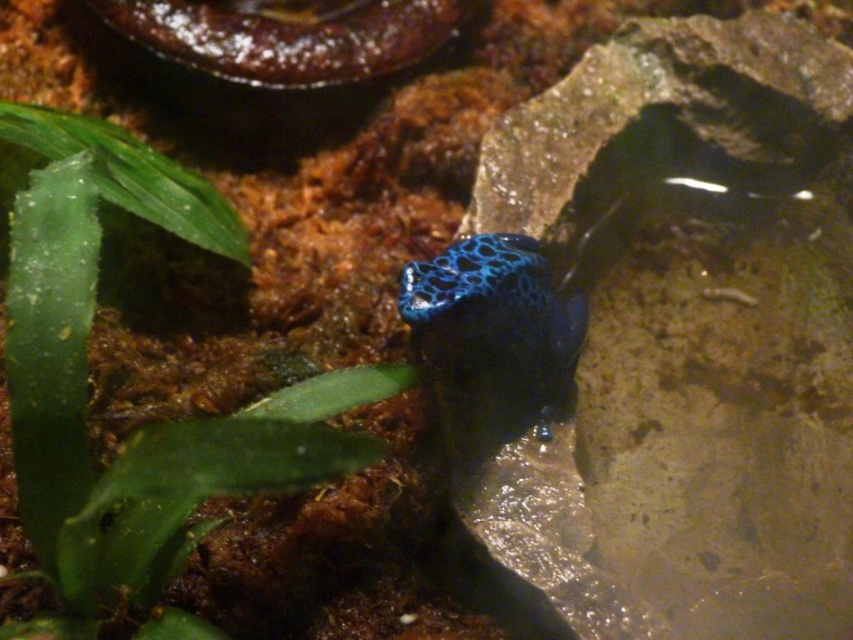
Question: Does green leafy plant at upper left appear over blue glossy frog at center?

Choices:
 (A) yes
 (B) no

Answer: (A)

Question: From the image, what is the correct spatial relationship of green leafy plant at upper left in relation to blue glossy frog at center?

Choices:
 (A) above
 (B) below

Answer: (A)

Question: Can you confirm if green leafy plant at upper left is positioned to the right of blue glossy frog at center?

Choices:
 (A) yes
 (B) no

Answer: (B)